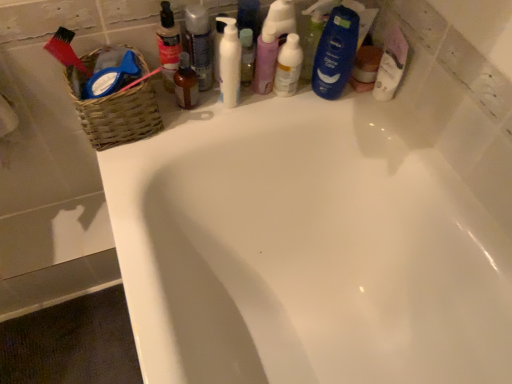
You are a GUI agent. You are given a task and a screenshot of the screen. Output one action in this format:
    pyautogui.click(x=<x>, y=<y>)
    Task: Click on the unoccupied area in front of purple matte lotion at center, which ranks as the 2th toiletry in right-to-left order
    The height and width of the screenshot is (384, 512).
    Given the screenshot: What is the action you would take?
    pyautogui.click(x=244, y=109)